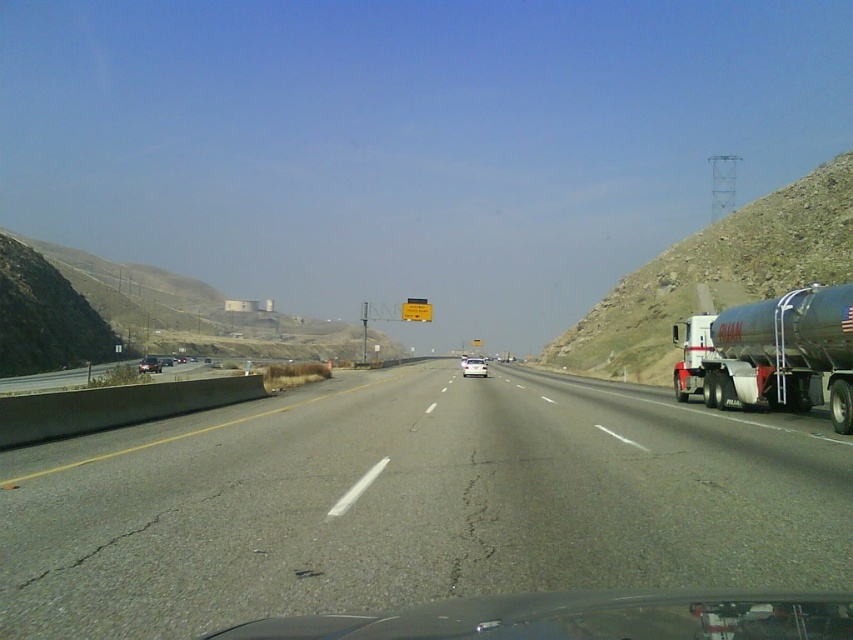
Can you confirm if asphalt road at center is positioned above white matte van at center?

Correct, asphalt road at center is located above white matte van at center.

Who is positioned more to the right, asphalt road at center or white matte van at center?

white matte van at center

Who is more distant from viewer, (473, 428) or (468, 362)?

The point (468, 362) is behind.

Identify the location of asphalt road at center. (412, 502).

Looking at this image, which of these two, asphalt road at center or transparent glass windshield at lower center, stands shorter?

transparent glass windshield at lower center is shorter.

Does point (123, 620) lie in front of point (242, 627)?

No.

Image resolution: width=853 pixels, height=640 pixels. I want to click on asphalt road at center, so click(x=412, y=502).

Is transparent glass windshield at lower center above metallic silver sedan at center?

Yes, transparent glass windshield at lower center is above metallic silver sedan at center.

Between transparent glass windshield at lower center and metallic silver sedan at center, which one has less height?

transparent glass windshield at lower center is shorter.

Does point (564, 596) lie behind point (151, 372)?

No, it is not.

The height and width of the screenshot is (640, 853). Find the location of `transparent glass windshield at lower center`. transparent glass windshield at lower center is located at coordinates (579, 618).